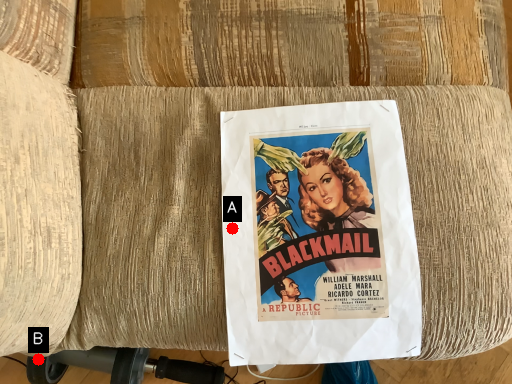
Question: Two points are circled on the image, labeled by A and B beside each circle. Which point is closer to the camera?

Choices:
 (A) A is closer
 (B) B is closer

Answer: (A)